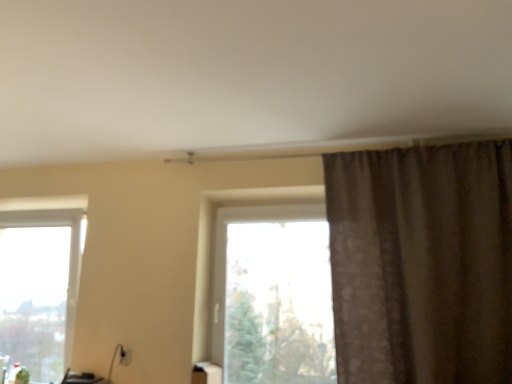
Question: Is the depth of white glossy tissue box at lower center greater than that of clear glass window at lower left, the 1th window from the left?

Choices:
 (A) no
 (B) yes

Answer: (A)

Question: From a real-world perspective, is white glossy tissue box at lower center physically below clear glass window at lower left, the 2th window in the right-to-left sequence?

Choices:
 (A) yes
 (B) no

Answer: (A)

Question: From the image's perspective, is white glossy tissue box at lower center under clear glass window at lower left, the 2th window in the right-to-left sequence?

Choices:
 (A) no
 (B) yes

Answer: (B)

Question: Would you consider white glossy tissue box at lower center to be distant from clear glass window at lower left, the 2th window in the right-to-left sequence?

Choices:
 (A) no
 (B) yes

Answer: (B)

Question: Does white glossy tissue box at lower center lie in front of clear glass window at lower left, the 2th window in the right-to-left sequence?

Choices:
 (A) no
 (B) yes

Answer: (B)

Question: Is point (298, 213) positioned closer to the camera than point (210, 367)?

Choices:
 (A) closer
 (B) farther

Answer: (B)

Question: Considering their positions, is transparent glass window at center, which appears as the first window when viewed from the right, located in front of or behind white glossy tissue box at lower center?

Choices:
 (A) front
 (B) behind

Answer: (A)

Question: From a real-world perspective, is transparent glass window at center, which appears as the first window when viewed from the right, positioned above or below white glossy tissue box at lower center?

Choices:
 (A) above
 (B) below

Answer: (A)

Question: Looking at the image, does transparent glass window at center, which appears as the first window when viewed from the right, seem bigger or smaller compared to white glossy tissue box at lower center?

Choices:
 (A) small
 (B) big

Answer: (B)

Question: Considering the positions of clear glass window at lower left, the 2th window in the right-to-left sequence, and white glossy tissue box at lower center in the image, is clear glass window at lower left, the 2th window in the right-to-left sequence, bigger or smaller than white glossy tissue box at lower center?

Choices:
 (A) small
 (B) big

Answer: (B)

Question: Is clear glass window at lower left, the 2th window in the right-to-left sequence, to the left or to the right of white glossy tissue box at lower center in the image?

Choices:
 (A) right
 (B) left

Answer: (B)

Question: Is clear glass window at lower left, the 1th window from the left, wider or thinner than white glossy tissue box at lower center?

Choices:
 (A) thin
 (B) wide

Answer: (B)

Question: In terms of height, does clear glass window at lower left, the 1th window from the left, look taller or shorter compared to white glossy tissue box at lower center?

Choices:
 (A) short
 (B) tall

Answer: (B)

Question: In the image, is white glossy tissue box at lower center on the left side or the right side of clear glass window at lower left, the 2th window in the right-to-left sequence?

Choices:
 (A) right
 (B) left

Answer: (A)

Question: Considering the positions of white glossy tissue box at lower center and clear glass window at lower left, the 1th window from the left, in the image, is white glossy tissue box at lower center wider or thinner than clear glass window at lower left, the 1th window from the left,?

Choices:
 (A) wide
 (B) thin

Answer: (B)